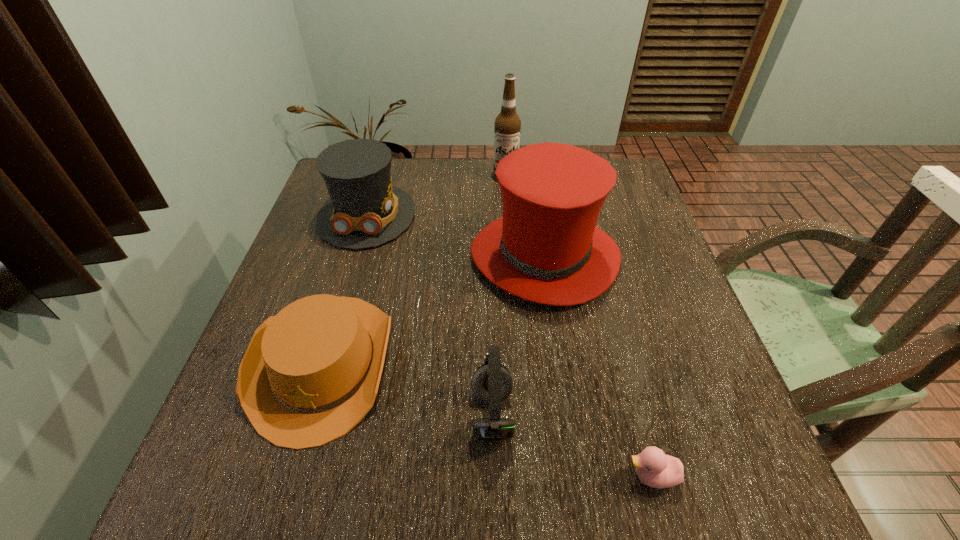
This screenshot has width=960, height=540. I want to click on alcohol, so click(x=507, y=127).

The image size is (960, 540). I want to click on the tallest object, so click(x=507, y=127).

Find the location of a particular element. Image resolution: width=960 pixels, height=540 pixels. the right dress hat is located at coordinates (546, 248).

What are the coordinates of `the taller dress hat` in the screenshot? It's located at (546, 248).

What are the coordinates of `the shorter dress hat` in the screenshot? It's located at (365, 210).

Locate an element on the screen. The image size is (960, 540). headset is located at coordinates (492, 383).

The image size is (960, 540). I want to click on cowboy hat, so click(x=310, y=374).

I want to click on the shortest object, so click(654, 468).

Locate an element on the screen. The width and height of the screenshot is (960, 540). the nearest object is located at coordinates (654, 468).

Image resolution: width=960 pixels, height=540 pixels. Identify the location of blank area located 0.360m on the label of the alcohol. (513, 264).